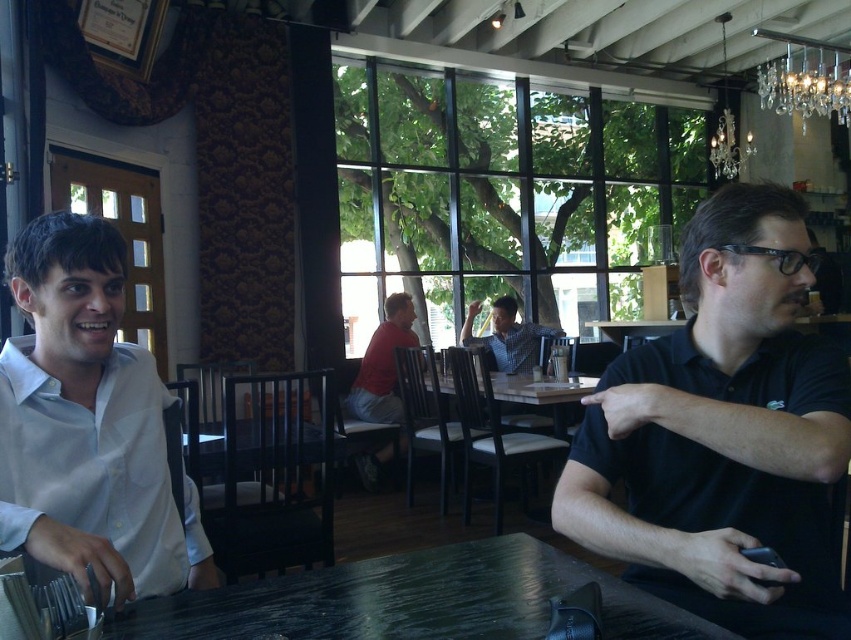
You are a customer in the cafe and want to place a small item between the black matte shirt at right and the matte red shirt at center. Given that the item is 1 foot long, will it fit in the space between them?

The distance between the black matte shirt at right and the matte red shirt at center is 11.21 feet, so the 1 foot long item will easily fit in the space between them.

You are a photographer trying to capture a group photo of the black matte shirt at right and the matte red shirt at center. If you want to ensure both subjects are fully visible in the frame without cropping, which subject should you position closer to the camera?

The black matte shirt at right might be wider than the matte red shirt at center, so positioning the black matte shirt at right closer to the camera would help ensure both are fully visible without cropping.

You are a customer in the cafe and want to ask the person in the matte red shirt at center for directions. Which direction should you turn your head to look at the black matte shirt at right?

The black matte shirt at right is to the right of the matte red shirt at center, so you should turn your head to the right to look at the black matte shirt at right.